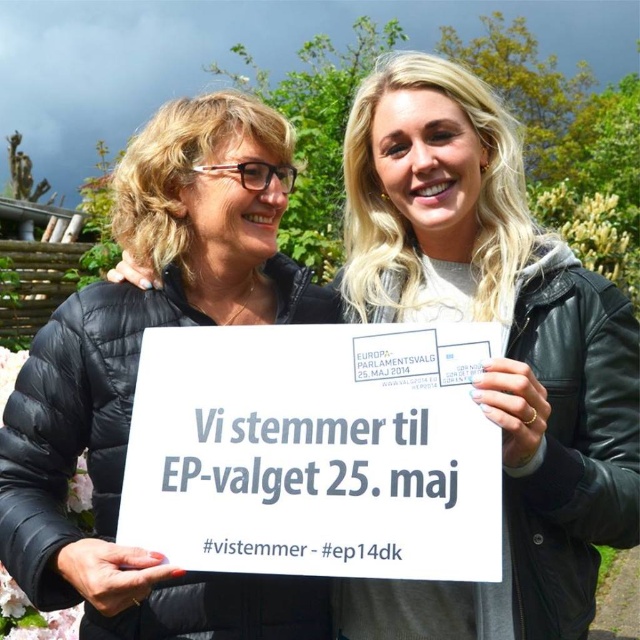
Question: Can you confirm if white matte sign at center is smaller than white paper sign at center?

Choices:
 (A) no
 (B) yes

Answer: (A)

Question: Which object is farther from the camera taking this photo?

Choices:
 (A) black quilted jacket at left
 (B) white paper sign at center
 (C) white matte sign at center

Answer: (C)

Question: Does white matte sign at center appear on the left side of white paper sign at center?

Choices:
 (A) no
 (B) yes

Answer: (A)

Question: Which object is the closest to the black quilted jacket at left?

Choices:
 (A) white matte sign at center
 (B) white paper sign at center

Answer: (B)

Question: Which of the following is the farthest from the observer?

Choices:
 (A) black quilted jacket at left
 (B) white paper sign at center

Answer: (A)

Question: Is white paper sign at center below black quilted jacket at left?

Choices:
 (A) no
 (B) yes

Answer: (B)